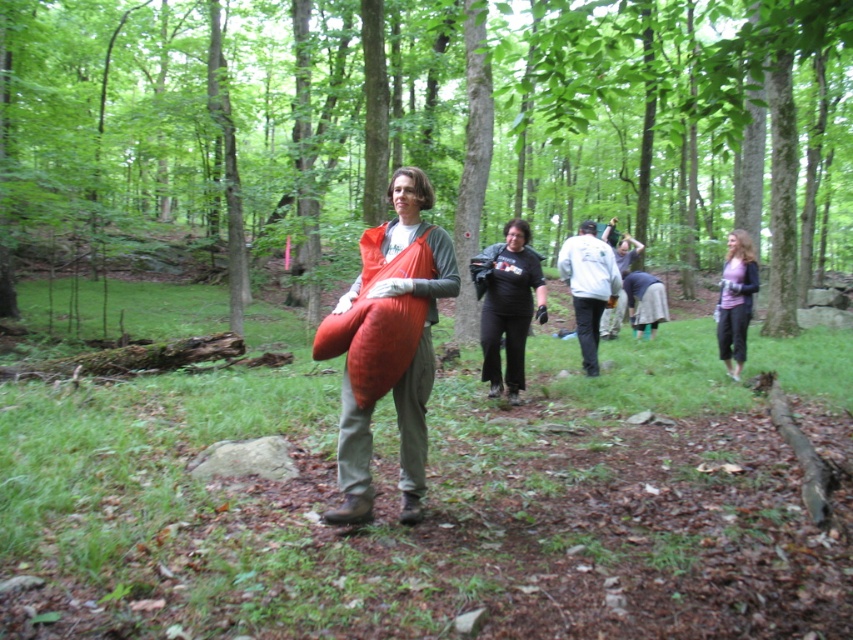
Who is positioned more to the right, green leafy tree at center or white matte jacket at center?

From the viewer's perspective, green leafy tree at center appears more on the right side.

The height and width of the screenshot is (640, 853). Describe the element at coordinates (424, 131) in the screenshot. I see `green leafy tree at center` at that location.

Is point (144, 252) farther from viewer compared to point (614, 292)?

Yes, it is behind point (614, 292).

Find the location of `green leafy tree at center`. green leafy tree at center is located at coordinates (424, 131).

Can you confirm if matte orange fabric bag at center is thinner than matte pink sweater at right?

Yes, matte orange fabric bag at center is thinner than matte pink sweater at right.

Which is more to the left, matte orange fabric bag at center or matte pink sweater at right?

From the viewer's perspective, matte orange fabric bag at center appears more on the left side.

Is point (415, 168) in front of point (724, 316)?

Yes, it is.

Where is `matte orange fabric bag at center`? matte orange fabric bag at center is located at coordinates (387, 344).

Which of these two, matte orange fabric bag at center or black matte shirt at center, stands taller?

With more height is matte orange fabric bag at center.

Can you confirm if matte orange fabric bag at center is positioned to the right of black matte shirt at center?

Incorrect, matte orange fabric bag at center is not on the right side of black matte shirt at center.

Where is `matte orange fabric bag at center`? The image size is (853, 640). matte orange fabric bag at center is located at coordinates (387, 344).

Find the location of a particular element. matte orange fabric bag at center is located at coordinates (387, 344).